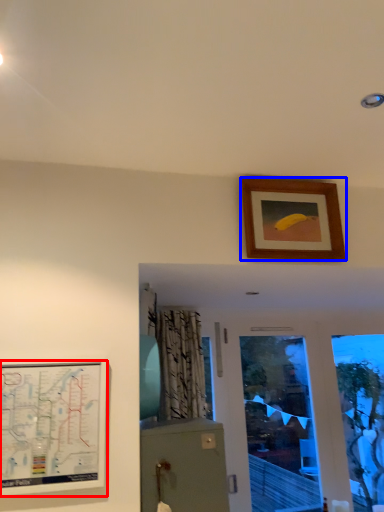
Question: Which object is further to the camera taking this photo, picture frame (highlighted by a red box) or picture frame (highlighted by a blue box)?

Choices:
 (A) picture frame
 (B) picture frame

Answer: (B)